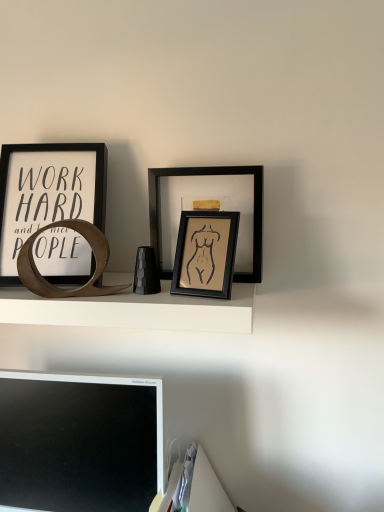
You are a GUI agent. You are given a task and a screenshot of the screen. Output one action in this format:
    pyautogui.click(x=<x>, y=<y>)
    Task: Click on the free space to the left of matte black picture frame at center, arranged as the second picture frame when viewed from the right
    The width and height of the screenshot is (384, 512).
    Given the screenshot: What is the action you would take?
    pyautogui.click(x=135, y=298)